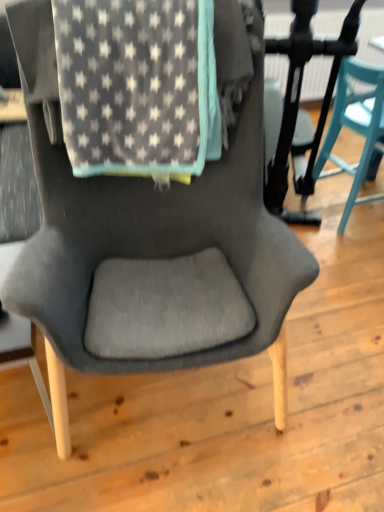
Measure the distance between teal plastic chair at right and camera.

teal plastic chair at right and camera are 1.92 meters apart.

What is the approximate width of teal plastic chair at right?

It is 17.98 inches.

In order to face teal plastic chair at right, should I rotate leftwards or rightwards?

Turn right by 22.760 degrees to look at teal plastic chair at right.

This screenshot has height=512, width=384. Identify the location of teal plastic chair at right. (354, 125).

The image size is (384, 512). Describe the element at coordinates (354, 125) in the screenshot. I see `teal plastic chair at right` at that location.

Locate an element on the screen. The width and height of the screenshot is (384, 512). gray star-patterned blanket at upper center is located at coordinates (138, 87).

Describe the element at coordinates (138, 87) in the screenshot. I see `gray star-patterned blanket at upper center` at that location.

What is the approximate width of gray star-patterned blanket at upper center?

gray star-patterned blanket at upper center is 19.67 inches wide.

Image resolution: width=384 pixels, height=512 pixels. In order to click on teal plastic chair at right in this screenshot , I will do `click(354, 125)`.

Does gray star-patterned blanket at upper center appear on the left side of teal plastic chair at right?

Yes.

Is gray star-patterned blanket at upper center behind teal plastic chair at right?

That is False.

Which is in front, point (174, 64) or point (346, 65)?

Point (174, 64)

From the image's perspective, is gray star-patterned blanket at upper center located above teal plastic chair at right?

No, from the image's perspective, gray star-patterned blanket at upper center is not above teal plastic chair at right.

From a real-world perspective, is gray star-patterned blanket at upper center positioned above or below teal plastic chair at right?

gray star-patterned blanket at upper center is above teal plastic chair at right.

Looking at their sizes, would you say gray star-patterned blanket at upper center is wider or thinner than teal plastic chair at right?

In the image, gray star-patterned blanket at upper center appears to be wider than teal plastic chair at right.

Considering the sizes of objects gray star-patterned blanket at upper center and teal plastic chair at right in the image provided, who is shorter, gray star-patterned blanket at upper center or teal plastic chair at right?

With less height is gray star-patterned blanket at upper center.

Is gray star-patterned blanket at upper center bigger than teal plastic chair at right?

No, gray star-patterned blanket at upper center is not bigger than teal plastic chair at right.

Is gray star-patterned blanket at upper center inside or outside of teal plastic chair at right?

gray star-patterned blanket at upper center is spatially situated outside teal plastic chair at right.

Is there a large distance between gray star-patterned blanket at upper center and teal plastic chair at right?

Yes, gray star-patterned blanket at upper center and teal plastic chair at right are located far from each other.

Is gray star-patterned blanket at upper center oriented away from teal plastic chair at right?

No, gray star-patterned blanket at upper center is not facing away from teal plastic chair at right.

What are the coordinates of `chair behind the gray star-patterned blanket at upper center` in the screenshot? It's located at (354, 125).

Based on their positions, is teal plastic chair at right located to the left or right of gray star-patterned blanket at upper center?

Clearly, teal plastic chair at right is on the right of gray star-patterned blanket at upper center in the image.

Which object is more forward, teal plastic chair at right or gray star-patterned blanket at upper center?

gray star-patterned blanket at upper center.

Does point (355, 122) come behind point (119, 18)?

Yes.

From the image's perspective, is teal plastic chair at right on top of gray star-patterned blanket at upper center?

Yes, from the image's perspective, teal plastic chair at right is on top of gray star-patterned blanket at upper center.

From a real-world perspective, relative to gray star-patterned blanket at upper center, is teal plastic chair at right vertically above or below?

Clearly, from a real-world perspective, teal plastic chair at right is below gray star-patterned blanket at upper center.

Which of these two, teal plastic chair at right or gray star-patterned blanket at upper center, is thinner?

teal plastic chair at right.

Who is shorter, teal plastic chair at right or gray star-patterned blanket at upper center?

Standing shorter between the two is gray star-patterned blanket at upper center.

Is teal plastic chair at right smaller than gray star-patterned blanket at upper center?

Actually, teal plastic chair at right might be larger than gray star-patterned blanket at upper center.

Is teal plastic chair at right located outside gray star-patterned blanket at upper center?

Yes.

Consider the image. Are teal plastic chair at right and gray star-patterned blanket at upper center beside each other?

They are not placed beside each other.

Is teal plastic chair at right positioned with its back to gray star-patterned blanket at upper center?

Yes, gray star-patterned blanket at upper center is at the back of teal plastic chair at right.

How many degrees apart are the facing directions of teal plastic chair at right and gray star-patterned blanket at upper center?

teal plastic chair at right and gray star-patterned blanket at upper center are facing 101 degrees away from each other.

This screenshot has width=384, height=512. Identify the location of blanket above the teal plastic chair at right (from a real-world perspective). (138, 87).

Locate an element on the screen. chair to the right of gray star-patterned blanket at upper center is located at coordinates (354, 125).

The image size is (384, 512). In the image, there is a gray star-patterned blanket at upper center. What are the coordinates of `chair above it (from the image's perspective)` in the screenshot? It's located at (354, 125).